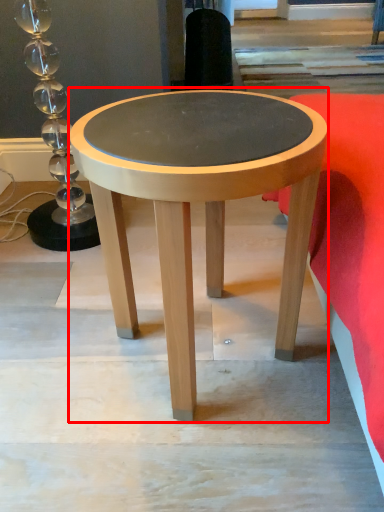
Question: From the image, what is the correct spatial relationship of coffee table (annotated by the red box) in relation to bedding?

Choices:
 (A) left
 (B) right

Answer: (A)